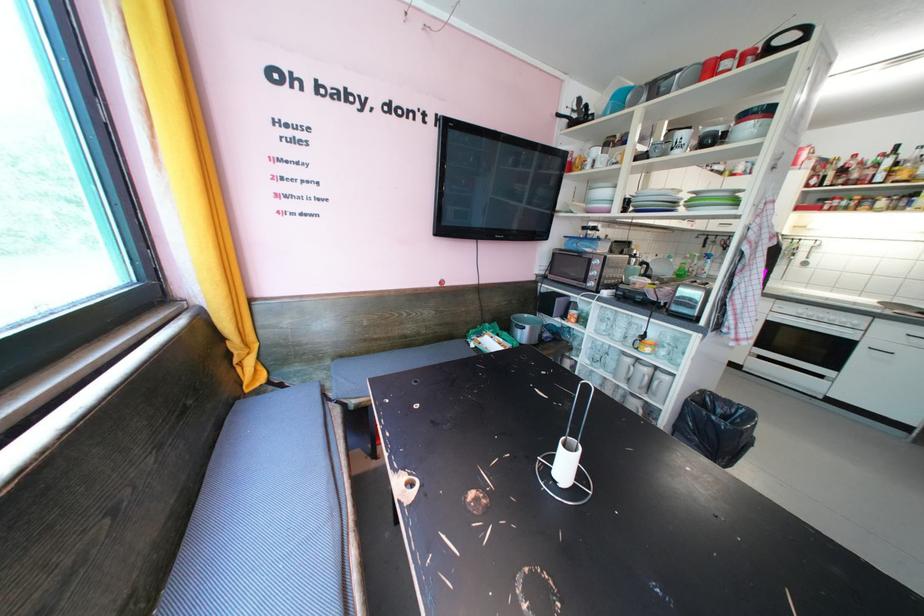
You are a GUI agent. You are given a task and a screenshot of the screen. Output one action in this format:
    pyautogui.click(x=<x>, y=<y>)
    Task: Click on the cabinet door handle
    
    Given the screenshot: What is the action you would take?
    pyautogui.click(x=880, y=352)